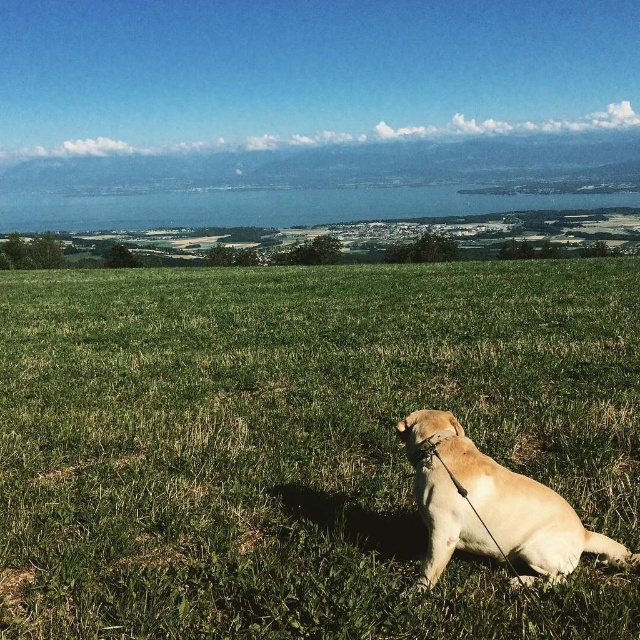
You are standing at the bottom of the slope where the golden Labrador Retriever is sitting on the right side. You want to walk directly towards the green grassy field at center. In which direction should you head?

You should head towards the center of the image because the green grassy field at center is located at point coordinates of (x=292, y=440), which is in the central area of the frame.